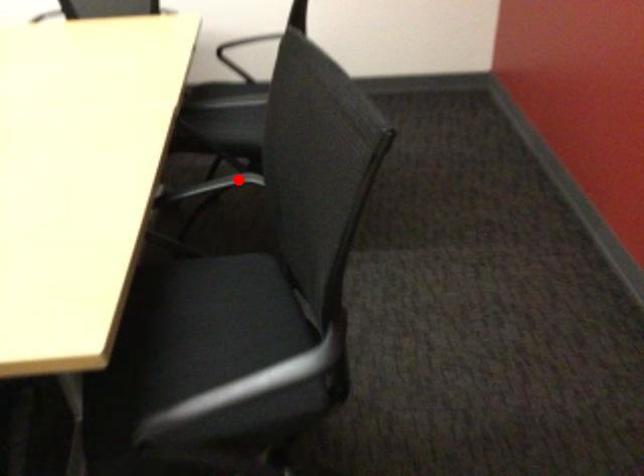
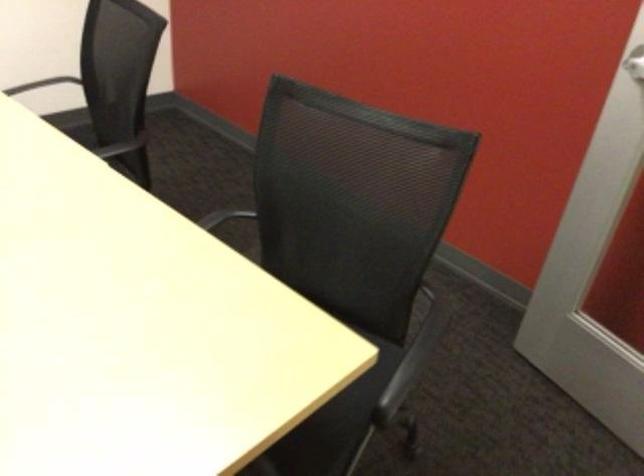
Question: I am providing you with two images of the same scene from different viewpoints. A red point is marked on the first image. Is the red point's position out of view in image 2?

Choices:
 (A) Yes
 (B) No

Answer: (B)